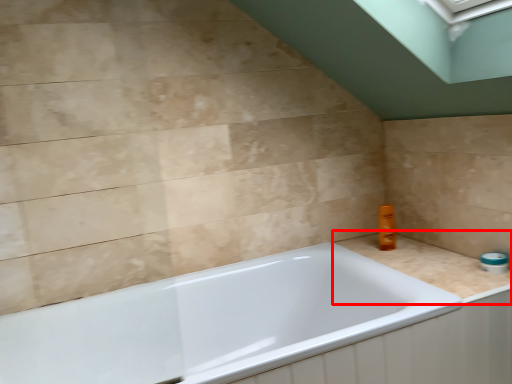
Question: From the image's perspective, where is counter top (annotated by the red box) located in relation to bathtub in the image?

Choices:
 (A) above
 (B) below

Answer: (A)